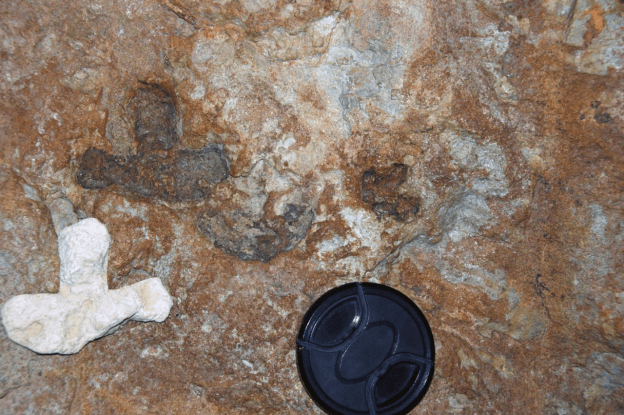
The width and height of the screenshot is (624, 415). Find the location of `surface`. surface is located at coordinates (432, 224).